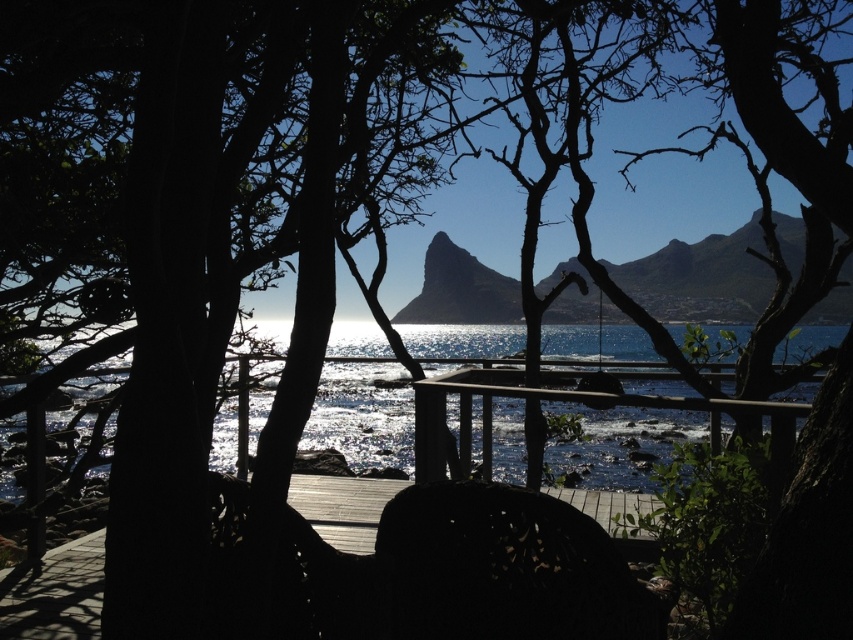
You are a photographer planning to set up a tripod to capture the coastal view through the trees. You have a black matte chair at center and a dark wood deck at center in your frame. Which object should you avoid placing your tripod in front of to ensure the coastal view remains visible?

The black matte chair at center is much taller than the dark wood deck at center, so placing the tripod in front of the dark wood deck at center would allow the coastal view to remain visible without obstruction.

You are standing on the wooden deck in the midground of the coastal scene. You see a black matte chair at center and translucent glass water at center. Which object is nearer to you?

The black matte chair at center is closer to the viewer than the translucent glass water at center, so the black matte chair at center is nearer to you.